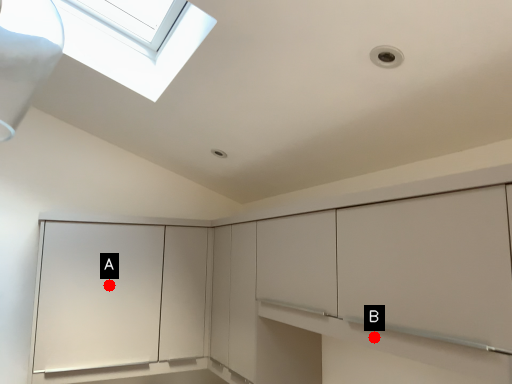
Question: Two points are circled on the image, labeled by A and B beside each circle. Among these points, which one is nearest to the camera?

Choices:
 (A) A is closer
 (B) B is closer

Answer: (B)